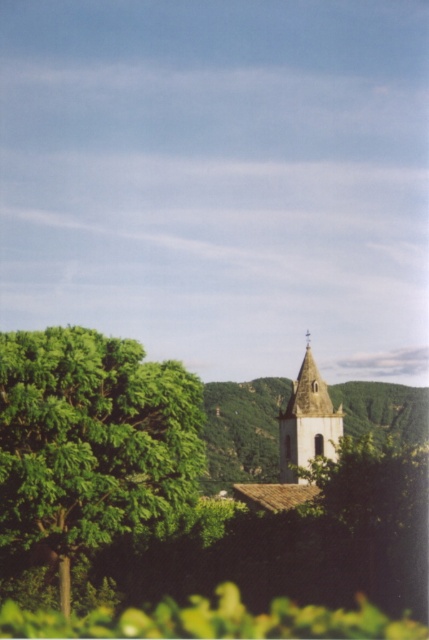
Can you confirm if white stone tower at center is positioned to the right of light brown stone church at center?

Yes, white stone tower at center is to the right of light brown stone church at center.

Between white stone tower at center and light brown stone church at center, which one is positioned higher?

Positioned higher is light brown stone church at center.

The image size is (429, 640). I want to click on white stone tower at center, so click(x=242, y=429).

Can you confirm if green leafy tree at left is positioned to the right of white stone tower at center?

Incorrect, green leafy tree at left is not on the right side of white stone tower at center.

Which is in front, point (114, 422) or point (350, 422)?

Point (114, 422) is in front.

Locate an element on the screen. green leafy tree at left is located at coordinates (90, 440).

Between green leafy tree at left and light brown stone church at center, which one has more height?

light brown stone church at center is taller.

Is point (66, 438) closer to viewer compared to point (302, 480)?

That is True.

The width and height of the screenshot is (429, 640). I want to click on green leafy tree at left, so click(90, 440).